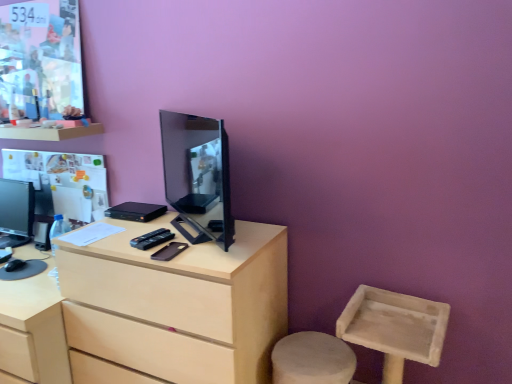
What are the coordinates of `unoccupied space behind black plastic remote control at center` in the screenshot? It's located at (150, 224).